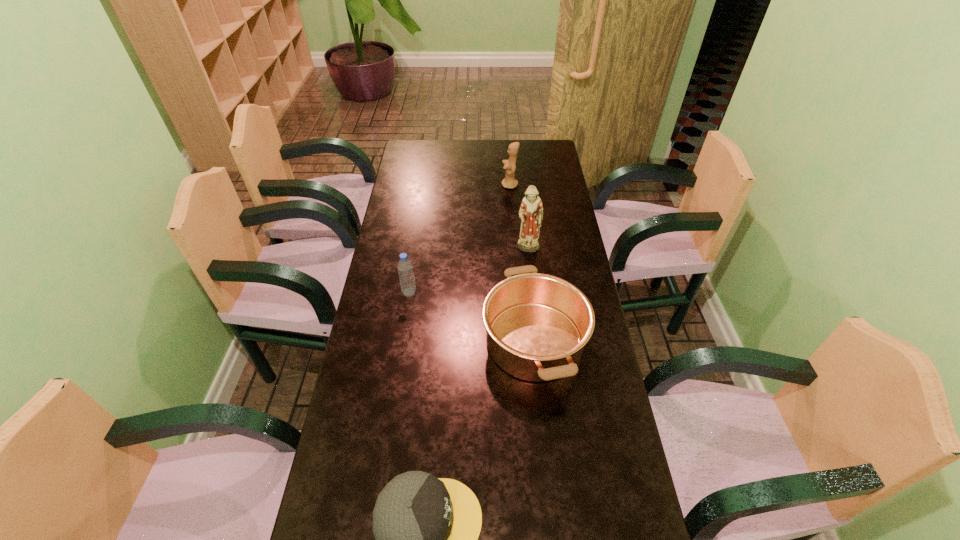
Image resolution: width=960 pixels, height=540 pixels. I want to click on the taller figurine, so click(x=531, y=210).

Locate an element on the screen. The image size is (960, 540). the nearer figurine is located at coordinates (531, 210).

Locate an element on the screen. Image resolution: width=960 pixels, height=540 pixels. the farther figurine is located at coordinates (510, 182).

The height and width of the screenshot is (540, 960). Find the location of `the shorter figurine`. the shorter figurine is located at coordinates (510, 182).

This screenshot has height=540, width=960. In order to click on the third tallest object in this screenshot , I will do `click(405, 268)`.

The width and height of the screenshot is (960, 540). I want to click on the second shortest object, so [537, 325].

The image size is (960, 540). Identify the location of vacant space located on the front-facing side of the nearer figurine. (535, 311).

You are a GUI agent. You are given a task and a screenshot of the screen. Output one action in this format:
    pyautogui.click(x=<x>, y=<y>)
    Task: Click on the free location located 0.230m on the front-facing side of the farthest object
    This screenshot has width=960, height=540.
    Given the screenshot: What is the action you would take?
    pyautogui.click(x=448, y=185)

Find the location of a particular element. vacant region located 0.100m on the front-facing side of the farthest object is located at coordinates (478, 185).

Where is `vacant region located on the front-facing side of the farthest object`? vacant region located on the front-facing side of the farthest object is located at coordinates (488, 185).